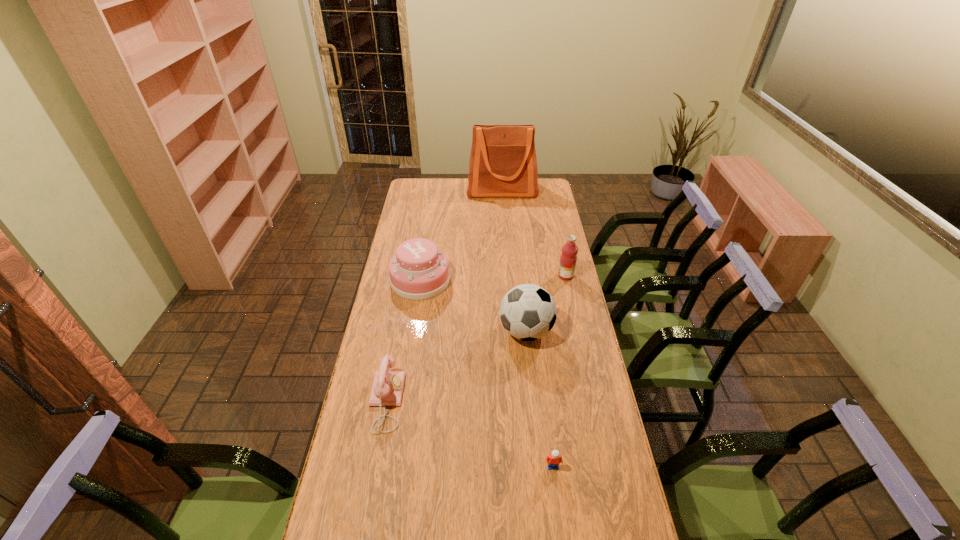
Find the location of `vacant space that's between the shortest object and the fruit juice`. vacant space that's between the shortest object and the fruit juice is located at coordinates (560, 371).

Identify the location of free spot between the fruit juice and the third shortest object. (493, 278).

You are a GUI agent. You are given a task and a screenshot of the screen. Output one action in this format:
    pyautogui.click(x=<x>, y=<y>)
    Task: Click on the free space between the birthday cake and the fourth farthest object
    This screenshot has width=960, height=540.
    Given the screenshot: What is the action you would take?
    pyautogui.click(x=473, y=306)

The width and height of the screenshot is (960, 540). What are the coordinates of `vacant space in between the farthest object and the fruit juice` in the screenshot? It's located at (534, 233).

What are the coordinates of `empty space that is in between the birthday cake and the fruit juice` in the screenshot? It's located at (493, 278).

You are a GUI agent. You are given a task and a screenshot of the screen. Output one action in this format:
    pyautogui.click(x=<x>, y=<y>)
    Task: Click on the empty location between the shortest object and the birthday cake
    
    Given the screenshot: What is the action you would take?
    pyautogui.click(x=487, y=373)

Identify the location of free spot between the soccer ball and the telephone. The image size is (960, 540). (456, 366).

Identify the location of free space between the nearest object and the fifth farthest object. This screenshot has height=540, width=960. (469, 434).

Choose which object is the nearest neighbor to the tallest object. Please provide its 2D coordinates. Your answer should be formatted as a tuple, i.e. [(x, y)], where the tuple contains the x and y coordinates of a point satisfying the conditions above.

[(418, 271)]

I want to click on object that stands as the third closest to the telephone, so click(x=553, y=460).